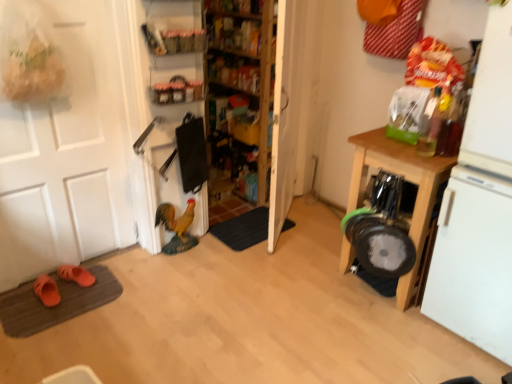
Locate an element on the screen. free space in front of orange rubber slippers at lower left, positioned as the first footwear in front-to-back order is located at coordinates (29, 319).